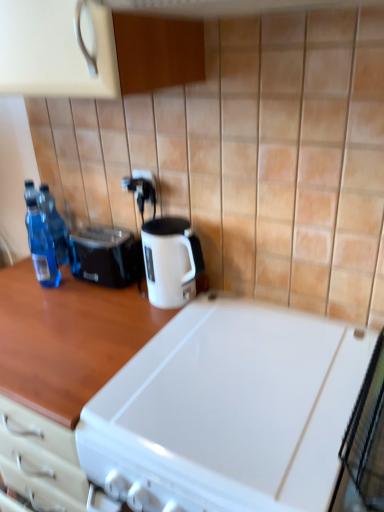
Where is `vacant space that is to the left of black plastic toaster at left`? vacant space that is to the left of black plastic toaster at left is located at coordinates point(47,286).